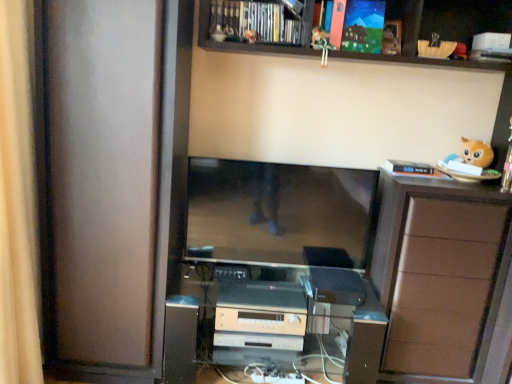
Where is `free spot above brown wood cabinet at right (from a real-world perspective)`? This screenshot has height=384, width=512. free spot above brown wood cabinet at right (from a real-world perspective) is located at coordinates click(441, 177).